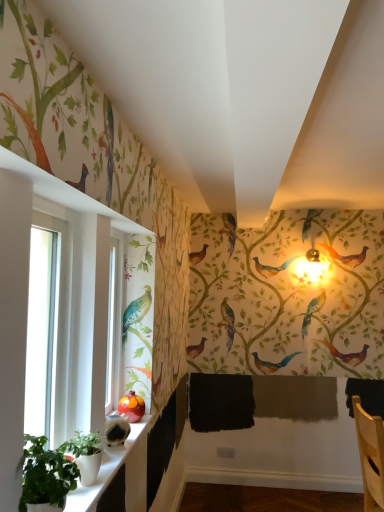
What are the coordinates of `vacant point above clear glass window at left (from a real-world perspective)` in the screenshot? It's located at (54, 203).